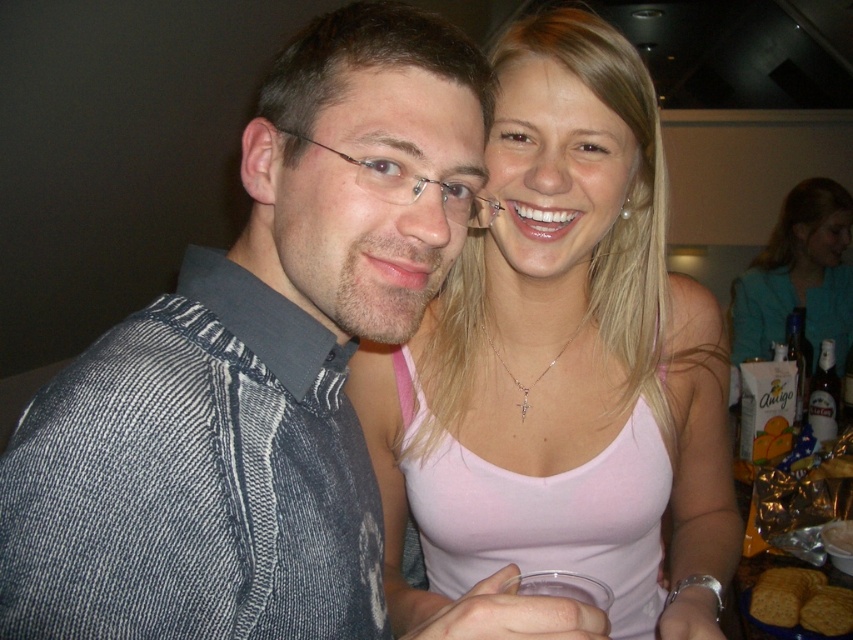
Can you confirm if denim shirt at left is smaller than brown glass bottle at right?

Incorrect, denim shirt at left is not smaller in size than brown glass bottle at right.

Which is behind, point (99, 522) or point (833, 404)?

The point (833, 404) is behind.

Is point (6, 460) positioned behind point (830, 413)?

No, (6, 460) is in front of (830, 413).

In order to click on denim shirt at left in this screenshot , I will do tap(253, 369).

Describe the element at coordinates (798, 276) in the screenshot. The image size is (853, 640). I see `pink fabric tank top at upper right` at that location.

Who is positioned more to the right, pink fabric tank top at upper right or brown glass bottle at right?

Positioned to the right is pink fabric tank top at upper right.

The width and height of the screenshot is (853, 640). In order to click on pink fabric tank top at upper right in this screenshot , I will do `click(798, 276)`.

From the picture: Does pink fabric tank top at upper center appear on the right side of pink fabric tank top at upper right?

Incorrect, pink fabric tank top at upper center is not on the right side of pink fabric tank top at upper right.

Does pink fabric tank top at upper center have a greater height compared to pink fabric tank top at upper right?

No, pink fabric tank top at upper center is not taller than pink fabric tank top at upper right.

In order to click on pink fabric tank top at upper center in this screenshot , I will do `click(564, 362)`.

You are a GUI agent. You are given a task and a screenshot of the screen. Output one action in this format:
    pyautogui.click(x=<x>, y=<y>)
    Task: Click on the pink fabric tank top at upper center
    
    Given the screenshot: What is the action you would take?
    coord(564,362)